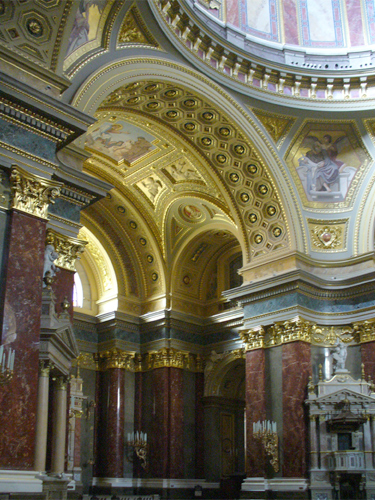
What are the coordinates of `dome ceiling` in the screenshot? It's located at (307, 22).